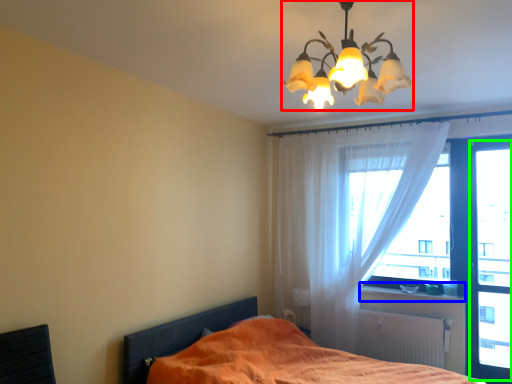
Question: Which object is positioned farthest from lamp (highlighted by a red box)? Select from window sill (highlighted by a blue box) and window screen (highlighted by a green box).

Choices:
 (A) window sill
 (B) window screen

Answer: (A)